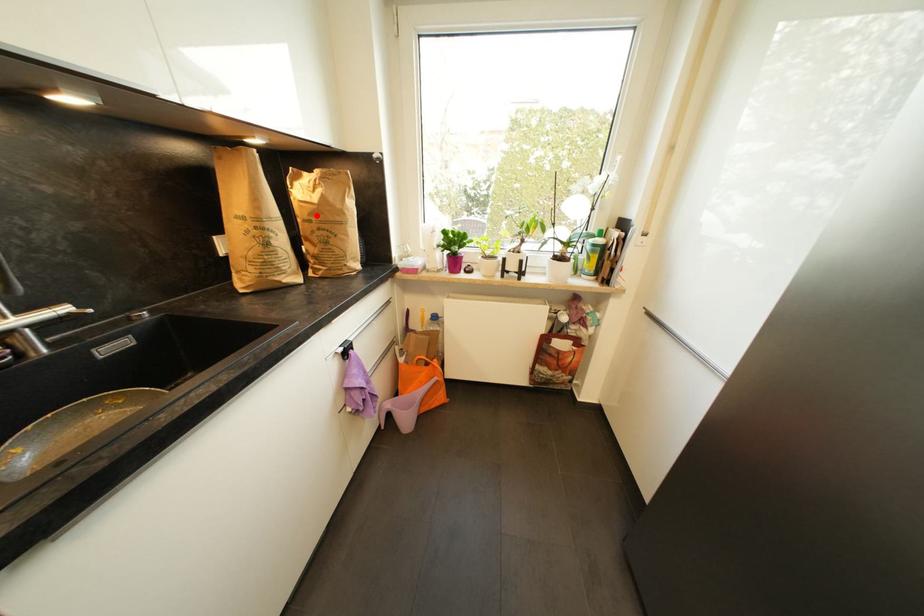
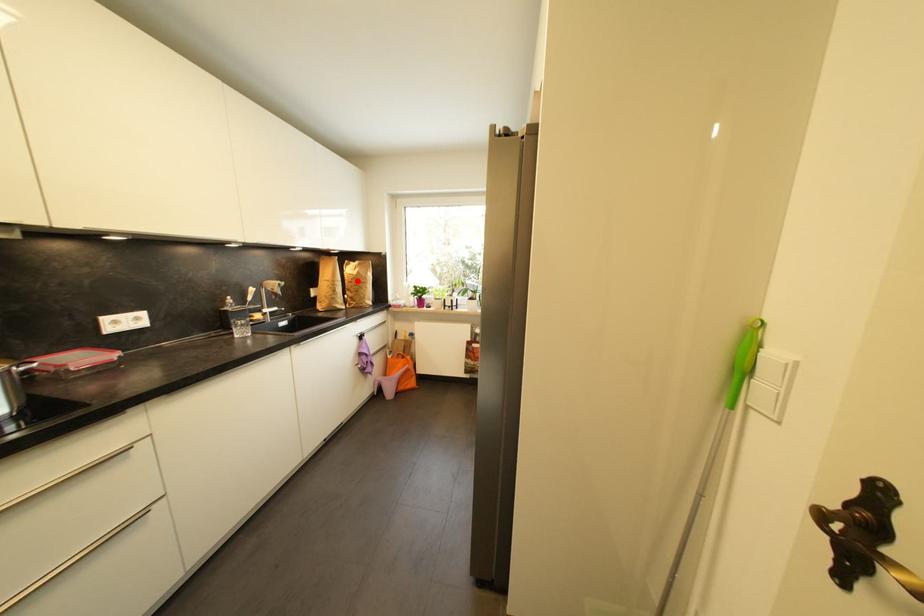
I am providing you with two images of the same scene from different viewpoints. A red point is marked on the first image and another point is marked on the second image. Is the red point in image1 aligned with the point shown in image2?

Yes